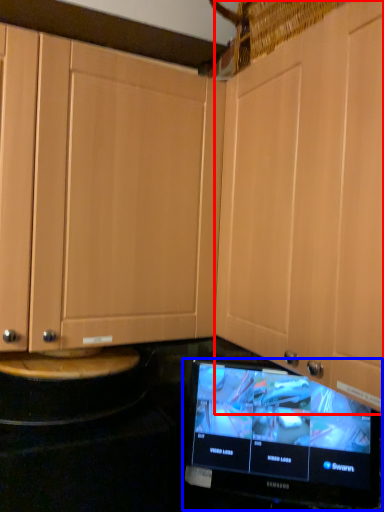
Question: Which point is closer to the camera, cabinetry (highlighted by a red box) or television (highlighted by a blue box)?

Choices:
 (A) cabinetry
 (B) television

Answer: (A)